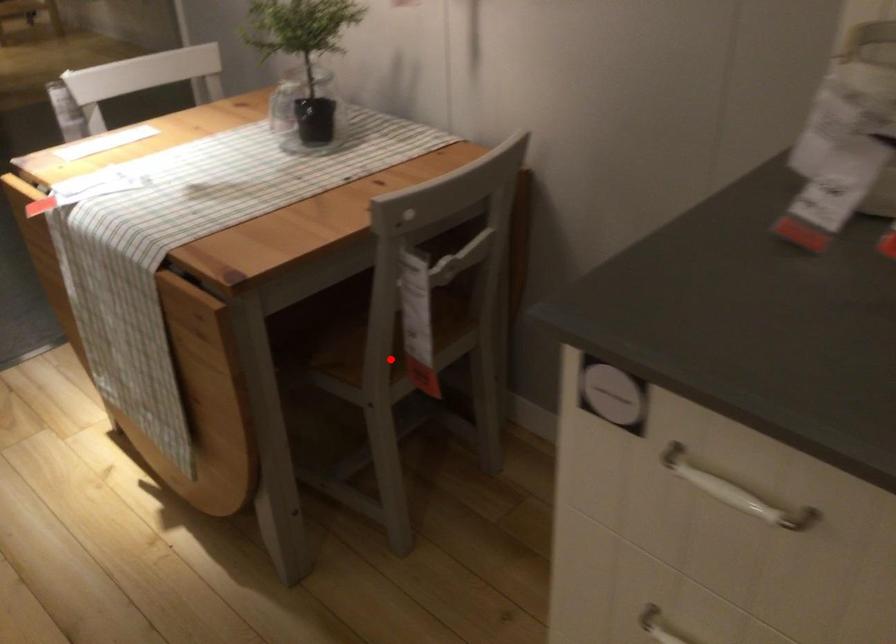
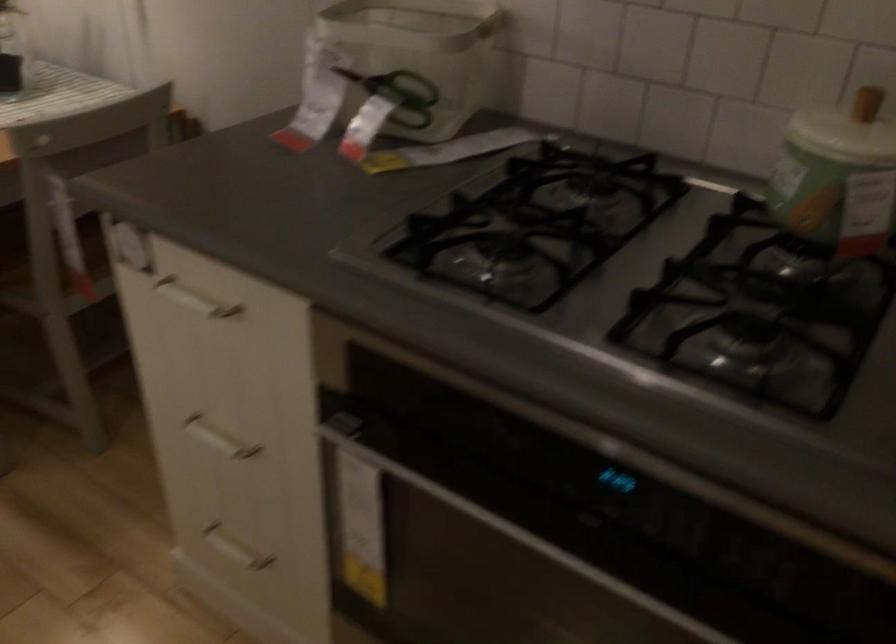
Question: I am providing you with two images of the same scene from different viewpoints. A red point is shown in image1. For the corresponding object point in image2, is it positioned nearer or farther from the camera?

Choices:
 (A) Nearer
 (B) Farther

Answer: (B)